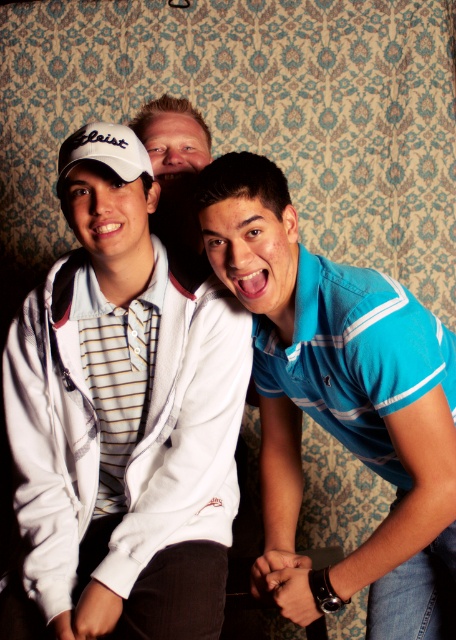
You are taking a photo of the three people in the scene. You want to focus on the white matte jacket at center and the white matte baseball cap at upper left. Which object should you adjust your camera focus on first to ensure both are in focus?

You should focus on the white matte jacket at center first because it is closer to the viewer than the white matte baseball cap at upper left, so adjusting focus starting from the closer object ensures both will be in focus.

You are trying to identify the positions of the white matte jacket at center and the white matte baseball cap at upper left in the image. Based on their spatial relationship, which one is located higher up?

The white matte baseball cap at upper left is located higher up than the white matte jacket at center.